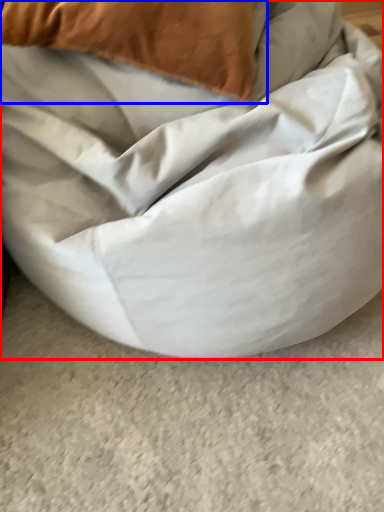
Question: Among these objects, which one is farthest to the camera, furniture (highlighted by a red box) or pillow (highlighted by a blue box)?

Choices:
 (A) furniture
 (B) pillow

Answer: (B)